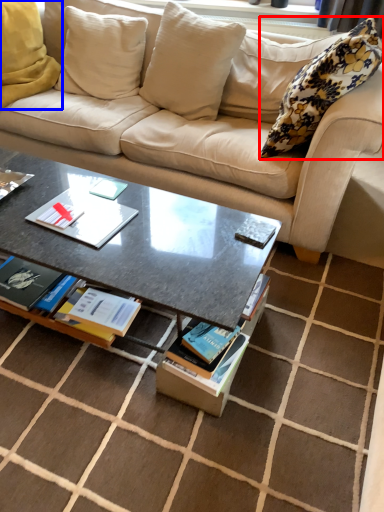
Question: Which point is closer to the camera, pillow (highlighted by a red box) or pillow (highlighted by a blue box)?

Choices:
 (A) pillow
 (B) pillow

Answer: (A)